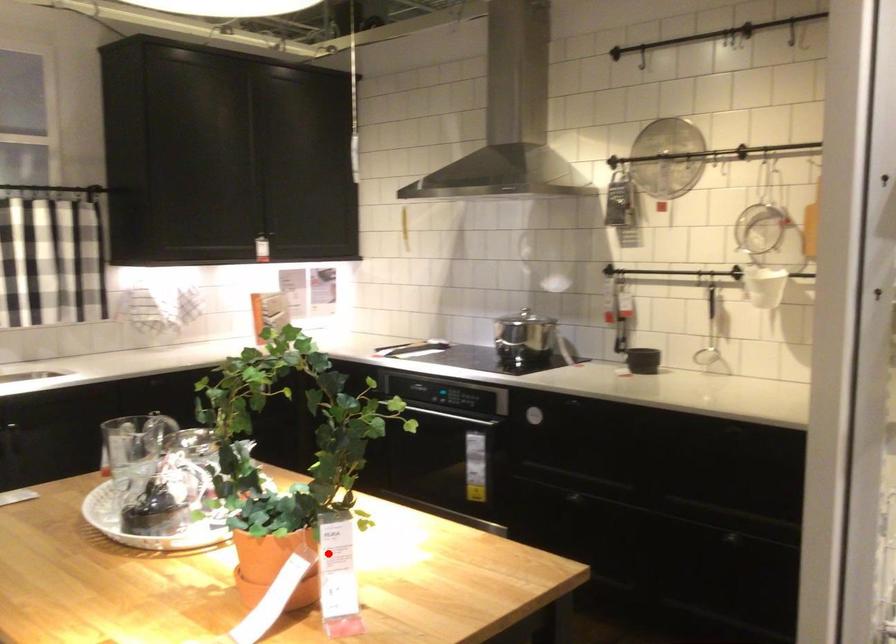
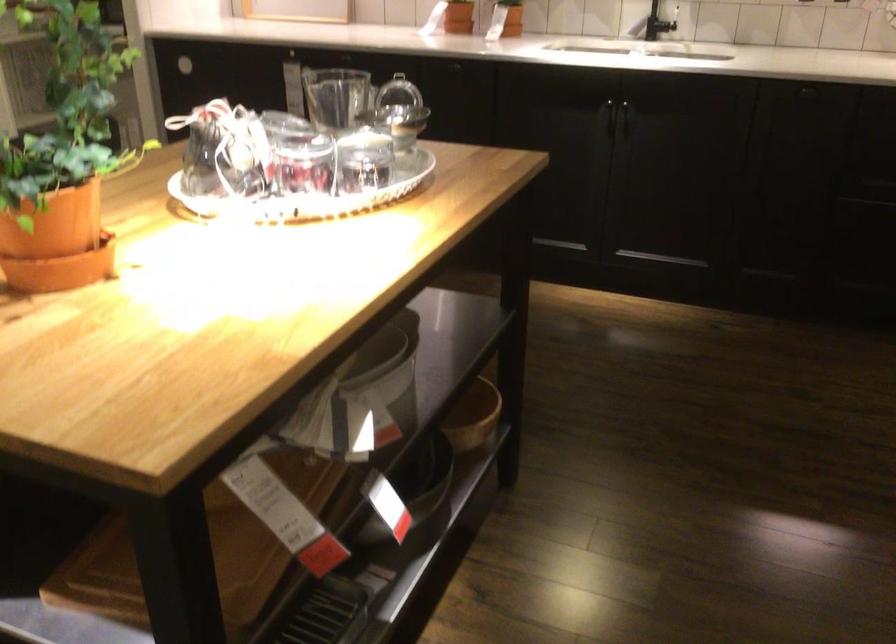
Question: I am providing you with two images of the same scene from different viewpoints. In image1, a red point is highlighted. Considering the same 3D point in image2, which of the following is correct?

Choices:
 (A) It is closer
 (B) It is farther

Answer: (A)